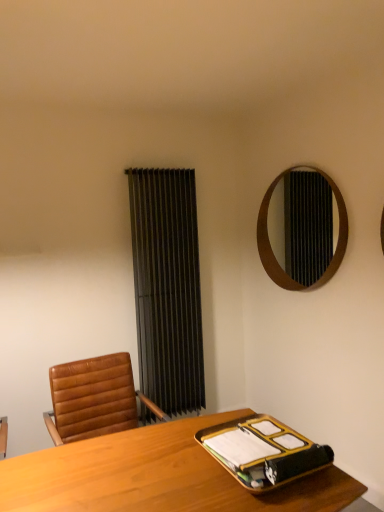
Question: From a real-world perspective, is gold metallic binder at lower right above or below light wood desk at center?

Choices:
 (A) below
 (B) above

Answer: (B)

Question: Is point (261, 472) positioned closer to the camera than point (8, 504)?

Choices:
 (A) closer
 (B) farther

Answer: (B)

Question: Which object is the closest to the wooden mirror at upper right?

Choices:
 (A) black fabric curtain at center
 (B) gold metallic binder at lower right
 (C) light wood desk at center

Answer: (A)

Question: Based on their relative distances, which object is farther from the wooden mirror at upper right?

Choices:
 (A) gold metallic binder at lower right
 (B) light wood desk at center
 (C) black fabric curtain at center

Answer: (B)